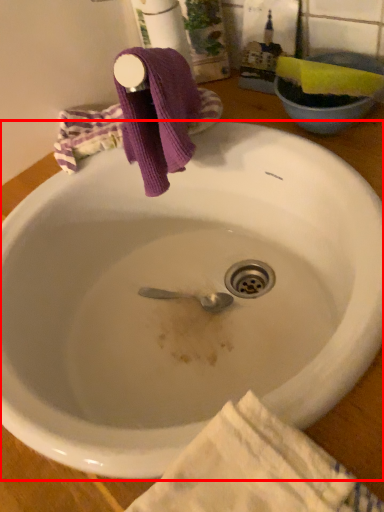
Question: From the image's perspective, what is the correct spatial positioning of sink (annotated by the red box) in reference to beach towel?

Choices:
 (A) below
 (B) above

Answer: (B)